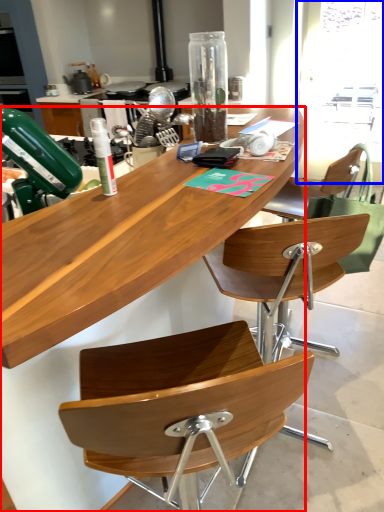
Question: Which object is further to the camera taking this photo, desk (highlighted by a red box) or window screen (highlighted by a blue box)?

Choices:
 (A) desk
 (B) window screen

Answer: (B)